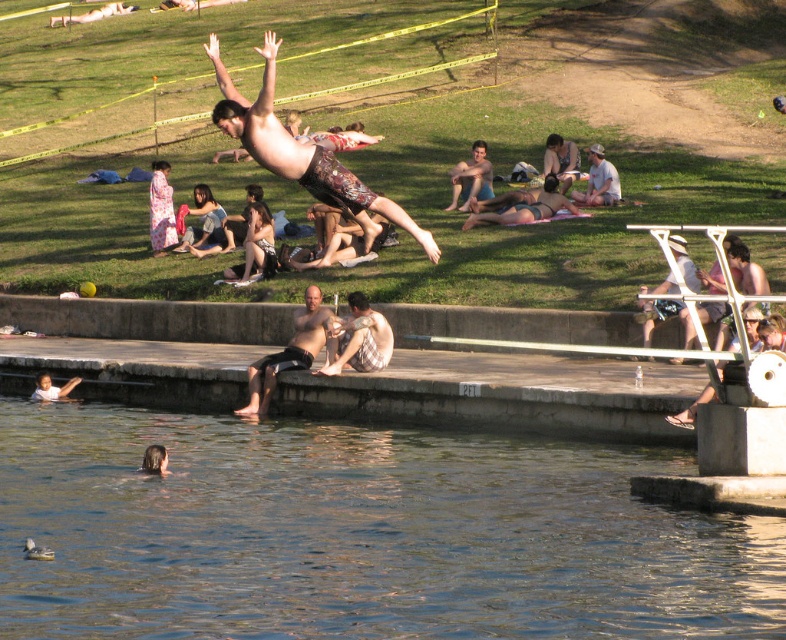
Question: Does plaid fabric shirt at center appear under plaid shirt at center?

Choices:
 (A) no
 (B) yes

Answer: (B)

Question: Is light brown plaid shorts at center further to the viewer compared to smooth skin child at lower left?

Choices:
 (A) no
 (B) yes

Answer: (B)

Question: Which point is farther to the camera?

Choices:
 (A) (472, 163)
 (B) (428, 612)

Answer: (A)

Question: Which object appears closest to the camera in this image?

Choices:
 (A) smooth skin child at lower left
 (B) light brown plaid shorts at center
 (C) plaid fabric shirt at center
 (D) black matte shorts at center

Answer: (C)

Question: Does clear water at lower left appear on the left side of black matte shorts at center?

Choices:
 (A) yes
 (B) no

Answer: (B)

Question: Which object is farther from the camera taking this photo?

Choices:
 (A) plaid shirt at center
 (B) black matte shorts at center
 (C) clear water at lower left
 (D) smooth skin child at lower left

Answer: (A)